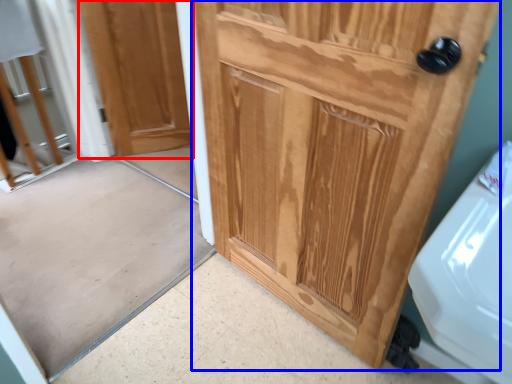
Question: Which object appears farthest to the camera in this image, door (highlighted by a red box) or door (highlighted by a blue box)?

Choices:
 (A) door
 (B) door

Answer: (A)